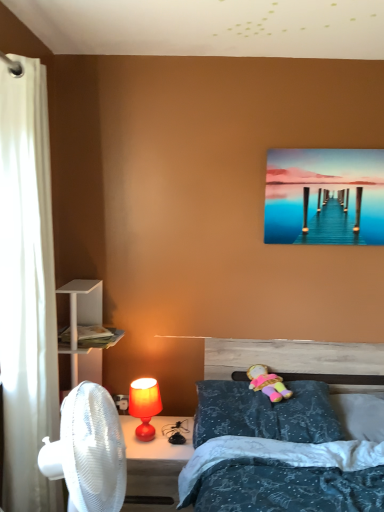
The height and width of the screenshot is (512, 384). Find the location of `free location in front of matte orange lamp at lower left`. free location in front of matte orange lamp at lower left is located at coordinates (144, 457).